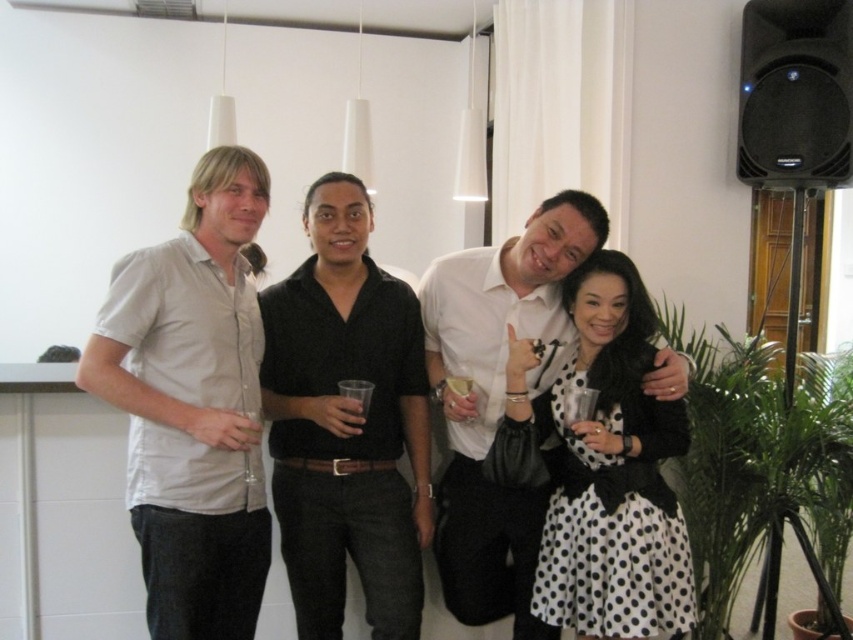
Who is more distant from viewer, (215,454) or (585,387)?

Point (585,387)

Does point (265, 554) lie in front of point (590, 410)?

That is False.

Is point (183, 570) in front of point (593, 410)?

Yes, it is.

You are a GUI agent. You are given a task and a screenshot of the screen. Output one action in this format:
    pyautogui.click(x=<x>, y=<y>)
    Task: Click on the light gray cotton shirt at left
    
    Given the screenshot: What is the action you would take?
    pyautogui.click(x=193, y=404)

Consider the image. Who is positioned more to the left, black plastic speaker at upper right or translucent plastic cup at center?

From the viewer's perspective, translucent plastic cup at center appears more on the left side.

From the picture: Does black plastic speaker at upper right come in front of translucent plastic cup at center?

No, black plastic speaker at upper right is further to the viewer.

Find the location of a particular element. black plastic speaker at upper right is located at coordinates (795, 93).

Does black smooth shirt at center appear under translucent plastic cup at center?

Indeed, black smooth shirt at center is positioned under translucent plastic cup at center.

Who is more forward, [384,420] or [469,388]?

Point [469,388] is more forward.

Find the location of a particular element. The height and width of the screenshot is (640, 853). black smooth shirt at center is located at coordinates (346, 422).